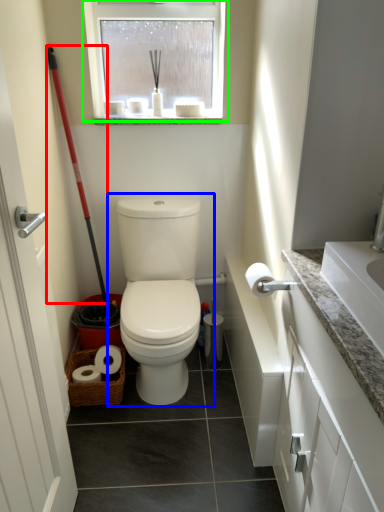
Question: Which object is positioned closest to shovel (highlighted by a red box)? Select from toilet (highlighted by a blue box) and window (highlighted by a green box).

Choices:
 (A) toilet
 (B) window

Answer: (B)